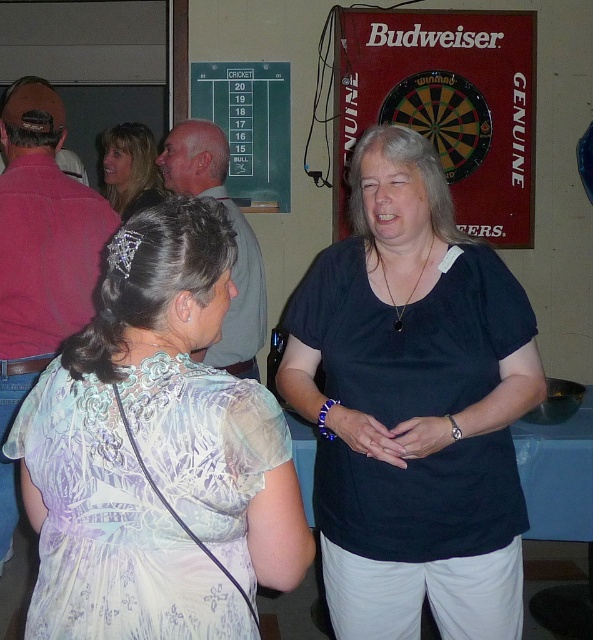
You are a photographer at this event and want to capture a photo that includes both the light purple sheer blouse at center and the green chalkboard at upper center. Based on their sizes, which object should you focus on to ensure both fit in the frame?

The light purple sheer blouse at center might be wider than the green chalkboard at upper center, so focusing on the wider object, the light purple sheer blouse at center, would help ensure both fit in the frame.

You are at the point with coordinates point (11, 157) and want to move to point (157, 198). Is the point you want to go to behind you or in front of you?

The point (157, 198) is behind point (11, 157), so the point you want to go to is behind you.

You are planning to hang a poster that is 1.2 meters wide on the wall. The poster needs to be wider than the gray hair at center. Can the green chalkboard at upper center help you determine if there is enough space?

The green chalkboard at upper center might be wider than gray hair at center. If the chalkboard is wider than the gray hair, then the space it occupies could potentially accommodate your 1.2 meter poster, provided the chalkboard itself is wide enough. However, since the exact width of the chalkboard isn